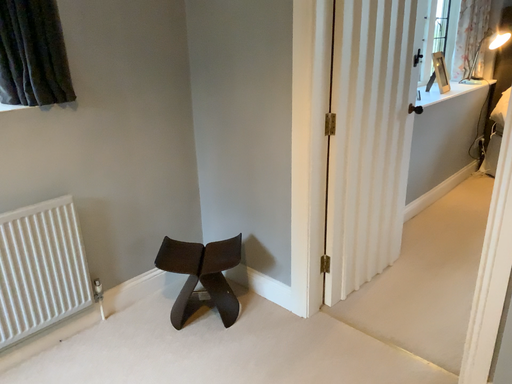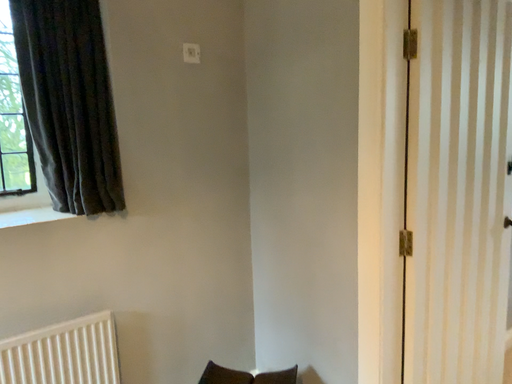
Question: How did the camera likely rotate when shooting the video?

Choices:
 (A) rotated downward
 (B) rotated upward

Answer: (B)